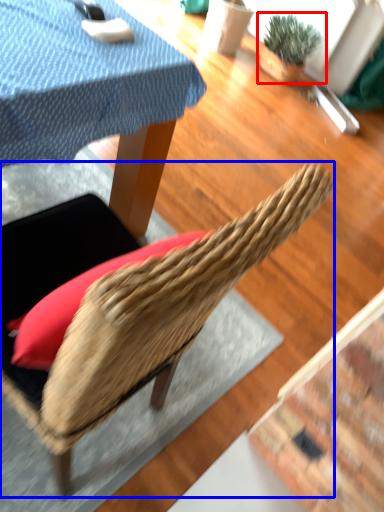
Question: Among these objects, which one is nearest to the camera, houseplant (highlighted by a red box) or chair (highlighted by a blue box)?

Choices:
 (A) houseplant
 (B) chair

Answer: (B)